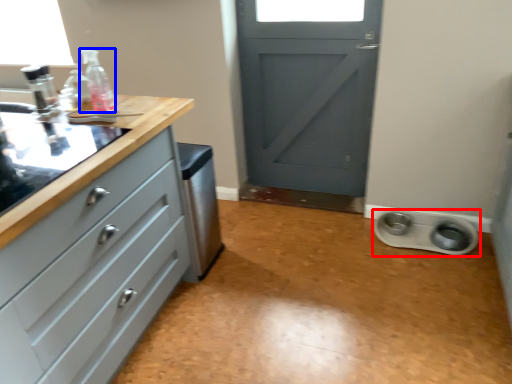
Question: Among these objects, which one is nearest to the camera, appliance (highlighted by a red box) or bottle (highlighted by a blue box)?

Choices:
 (A) appliance
 (B) bottle

Answer: (B)